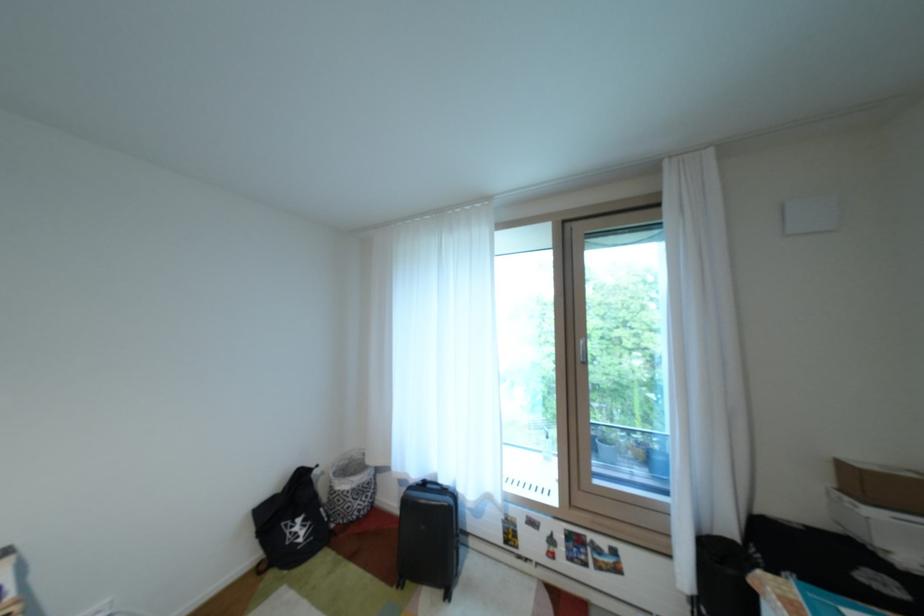
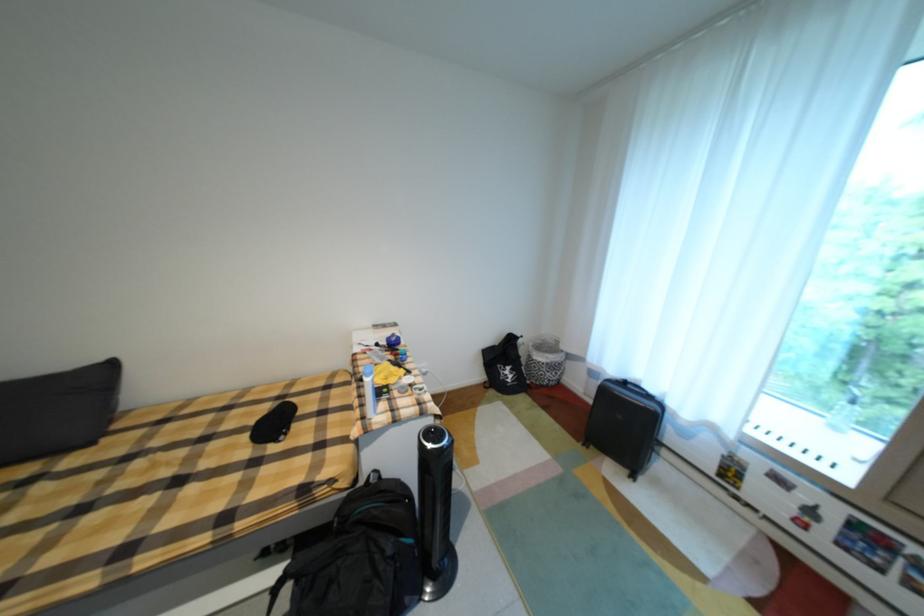
Locate, in the second image, the point that corresponds to [434,485] in the first image.

(635, 384)